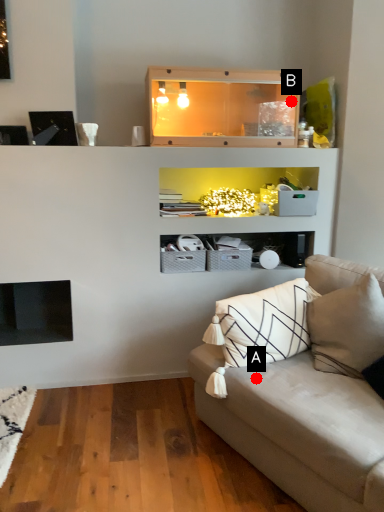
Question: Two points are circled on the image, labeled by A and B beside each circle. Which point is further to the camera?

Choices:
 (A) A is further
 (B) B is further

Answer: (B)